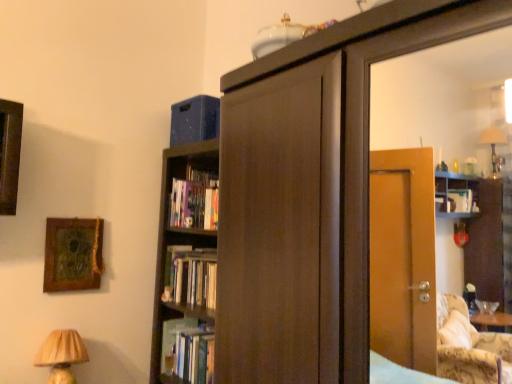
Where is `hardcover book at center, which appears as the 1th book when ordered from the bottom`? The image size is (512, 384). hardcover book at center, which appears as the 1th book when ordered from the bottom is located at coordinates (187, 351).

Describe the element at coordinates (61, 355) in the screenshot. I see `beige pleated lampshade at lower left` at that location.

Identify the location of wooden textured picture frame at upper left. (x=73, y=254).

This screenshot has height=384, width=512. What do you see at coordinates (73, 254) in the screenshot?
I see `wooden textured picture frame at upper left` at bounding box center [73, 254].

This screenshot has height=384, width=512. What are the coordinates of `hardcover book at center, which appears as the 1th book when ordered from the bottom` in the screenshot? It's located at (187, 351).

Image resolution: width=512 pixels, height=384 pixels. I want to click on book directly beneath the hardcover book at center, which is the 1th book in top-to-bottom order (from a real-world perspective), so click(187, 351).

In the scene shown: Is hardcover book at center, which appears as the 1th book when ordered from the bottom, not close to hardcover book at center, which is the 1th book in top-to-bottom order?

No, hardcover book at center, which appears as the 1th book when ordered from the bottom, is in close proximity to hardcover book at center, which is the 1th book in top-to-bottom order.

Measure the distance between hardcover book at center, which appears as the 1th book when ordered from the bottom, and hardcover book at center, acting as the 2th book starting from the bottom.

hardcover book at center, which appears as the 1th book when ordered from the bottom, is 21.71 centimeters away from hardcover book at center, acting as the 2th book starting from the bottom.

Could you tell me if hardcover book at center, the second book from the top, is turned towards hardcover book at center, which is the 1th book in top-to-bottom order?

No, hardcover book at center, the second book from the top, is not aimed at hardcover book at center, which is the 1th book in top-to-bottom order.

From the image's perspective, between hardcover book at center, acting as the 2th book starting from the bottom, and wooden textured picture frame at upper left, which one is located above?

wooden textured picture frame at upper left, from the image's perspective.

In the scene shown: Can you tell me how much hardcover book at center, which is the 1th book in top-to-bottom order, and wooden textured picture frame at upper left differ in facing direction?

hardcover book at center, which is the 1th book in top-to-bottom order, and wooden textured picture frame at upper left are facing 90 degrees away from each other.

Is hardcover book at center, acting as the 2th book starting from the bottom, next to wooden textured picture frame at upper left and touching it?

hardcover book at center, acting as the 2th book starting from the bottom, and wooden textured picture frame at upper left are not in contact.

Which is behind, hardcover book at center, which is the 1th book in top-to-bottom order, or wooden textured picture frame at upper left?

hardcover book at center, which is the 1th book in top-to-bottom order.

Considering the relative sizes of wooden textured picture frame at upper left and hardcover book at center, acting as the 2th book starting from the bottom, in the image provided, is wooden textured picture frame at upper left thinner than hardcover book at center, acting as the 2th book starting from the bottom,?

Indeed, wooden textured picture frame at upper left has a lesser width compared to hardcover book at center, acting as the 2th book starting from the bottom.

Is wooden textured picture frame at upper left positioned beyond the bounds of hardcover book at center, which is the 1th book in top-to-bottom order?

wooden textured picture frame at upper left is positioned outside hardcover book at center, which is the 1th book in top-to-bottom order.

From the image's perspective, is wooden textured picture frame at upper left above hardcover book at center, which is the 1th book in top-to-bottom order?

Yes, from the image's perspective, wooden textured picture frame at upper left is on top of hardcover book at center, which is the 1th book in top-to-bottom order.

Can you tell me how much wooden textured picture frame at upper left and hardcover book at center, which is the 1th book in top-to-bottom order, differ in facing direction?

They differ by 90 degrees in their facing directions.

Is beige pleated lampshade at lower left closer to the viewer compared to wooden textured picture frame at upper left?

Yes, beige pleated lampshade at lower left is closer to the viewer.

Could you tell me if beige pleated lampshade at lower left is turned towards wooden textured picture frame at upper left?

No, beige pleated lampshade at lower left does not turn towards wooden textured picture frame at upper left.

Does beige pleated lampshade at lower left appear on the right side of wooden textured picture frame at upper left?

Correct, you'll find beige pleated lampshade at lower left to the right of wooden textured picture frame at upper left.

Is beige pleated lampshade at lower left wider or thinner than wooden textured picture frame at upper left?

Clearly, beige pleated lampshade at lower left has more width compared to wooden textured picture frame at upper left.

How distant is hardcover book at center, the second book from the top, from wooden textured picture frame at upper left?

hardcover book at center, the second book from the top, and wooden textured picture frame at upper left are 22.15 inches apart from each other.

Between hardcover book at center, the second book from the top, and wooden textured picture frame at upper left, which one has more height?

wooden textured picture frame at upper left.

Could you tell me if hardcover book at center, which appears as the 1th book when ordered from the bottom, is turned towards wooden textured picture frame at upper left?

No.

Is hardcover book at center, which appears as the 1th book when ordered from the bottom, far from wooden textured picture frame at upper left?

No, hardcover book at center, which appears as the 1th book when ordered from the bottom, is not far from wooden textured picture frame at upper left.

Can you tell me how much beige pleated lampshade at lower left and hardcover book at center, which appears as the 1th book when ordered from the bottom, differ in facing direction?

The angular difference between beige pleated lampshade at lower left and hardcover book at center, which appears as the 1th book when ordered from the bottom, is 89.8 degrees.

Between beige pleated lampshade at lower left and hardcover book at center, which appears as the 1th book when ordered from the bottom, which one has larger width?

Wider between the two is hardcover book at center, which appears as the 1th book when ordered from the bottom.

Is beige pleated lampshade at lower left bigger than hardcover book at center, which appears as the 1th book when ordered from the bottom?

Yes.

Considering the positions of points (62, 371) and (193, 321), is point (62, 371) farther from camera compared to point (193, 321)?

No.

What are the coordinates of `the 1st book behind the beige pleated lampshade at lower left, counting from the anchor's position` in the screenshot? It's located at (190, 276).

Which is closer to the camera, (44, 350) or (181, 257)?

Point (44, 350) is positioned closer to the camera compared to point (181, 257).

Can you confirm if beige pleated lampshade at lower left is wider than hardcover book at center, acting as the 2th book starting from the bottom?

Yes, beige pleated lampshade at lower left is wider than hardcover book at center, acting as the 2th book starting from the bottom.

Based on the photo, is beige pleated lampshade at lower left facing away from hardcover book at center, acting as the 2th book starting from the bottom?

beige pleated lampshade at lower left is not turned away from hardcover book at center, acting as the 2th book starting from the bottom.

Locate an element on the screen. This screenshot has width=512, height=384. book lying behind the hardcover book at center, acting as the 2th book starting from the bottom is located at coordinates (187, 351).

Locate an element on the screen. The height and width of the screenshot is (384, 512). picture frame that is in front of the hardcover book at center, acting as the 2th book starting from the bottom is located at coordinates (73, 254).

Based on their spatial positions, is hardcover book at center, which is the 1th book in top-to-bottom order, or hardcover book at center, the second book from the top, further from beige pleated lampshade at lower left?

Among the two, hardcover book at center, which is the 1th book in top-to-bottom order, is located further to beige pleated lampshade at lower left.

Considering their positions, is beige pleated lampshade at lower left positioned closer to hardcover book at center, which is the 1th book in top-to-bottom order, than wooden textured picture frame at upper left?

Among the two, wooden textured picture frame at upper left is located nearer to hardcover book at center, which is the 1th book in top-to-bottom order.

Looking at the image, which one is located closer to wooden textured picture frame at upper left, beige pleated lampshade at lower left or hardcover book at center, which is the 1th book in top-to-bottom order?

The object closer to wooden textured picture frame at upper left is beige pleated lampshade at lower left.

Looking at the image, which one is located further to wooden textured picture frame at upper left, hardcover book at center, which appears as the 1th book when ordered from the bottom, or beige pleated lampshade at lower left?

hardcover book at center, which appears as the 1th book when ordered from the bottom.

Based on their spatial positions, is hardcover book at center, which appears as the 1th book when ordered from the bottom, or wooden textured picture frame at upper left further from hardcover book at center, which is the 1th book in top-to-bottom order?

wooden textured picture frame at upper left is further to hardcover book at center, which is the 1th book in top-to-bottom order.

When comparing their distances from hardcover book at center, acting as the 2th book starting from the bottom, does beige pleated lampshade at lower left or hardcover book at center, which appears as the 1th book when ordered from the bottom, seem closer?

hardcover book at center, which appears as the 1th book when ordered from the bottom.

Based on the photo, estimate the real-world distances between objects in this image. Which object is closer to beige pleated lampshade at lower left, hardcover book at center, acting as the 2th book starting from the bottom, or wooden textured picture frame at upper left?

wooden textured picture frame at upper left lies closer to beige pleated lampshade at lower left than the other object.

From the image, which object appears to be nearer to hardcover book at center, which appears as the 1th book when ordered from the bottom, hardcover book at center, which is the 1th book in top-to-bottom order, or beige pleated lampshade at lower left?

hardcover book at center, which is the 1th book in top-to-bottom order, lies closer to hardcover book at center, which appears as the 1th book when ordered from the bottom, than the other object.

The image size is (512, 384). What are the coordinates of `table lamp between wooden textured picture frame at upper left and hardcover book at center, which is the 1th book in top-to-bottom order, from left to right` in the screenshot? It's located at (61, 355).

I want to click on table lamp between wooden textured picture frame at upper left and hardcover book at center, the second book from the top, from top to bottom, so click(61, 355).

The width and height of the screenshot is (512, 384). What are the coordinates of `book that lies between wooden textured picture frame at upper left and hardcover book at center, which appears as the 1th book when ordered from the bottom, from top to bottom` in the screenshot? It's located at (190, 276).

Locate an element on the screen. book between beige pleated lampshade at lower left and hardcover book at center, the second book from the top, in the front-back direction is located at coordinates (190, 276).